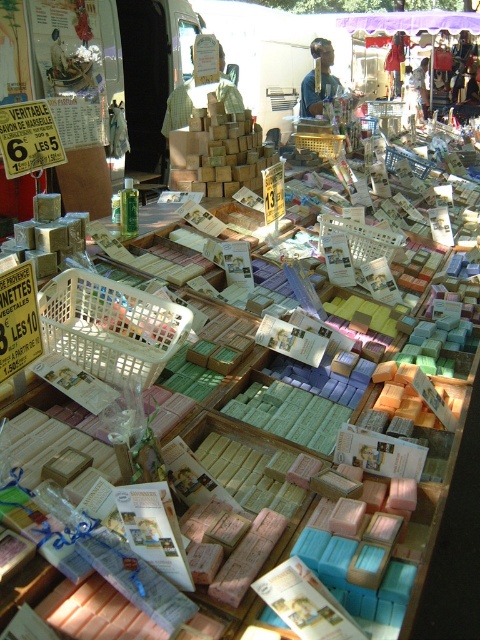
You are a customer at the market stall and want to pick up the matte brown wooden stick at upper center. However, there is a matte white shirt at upper center in the way. Can you reach the stick without moving the shirt?

The matte brown wooden stick at upper center is closer to the viewer than the matte white shirt at upper center, so you can reach the stick without moving the shirt.

You are a customer at the market stall and want to pick up both items located at point (322, 74) and point (421, 86). Which item should you pick up first to reach them in the shortest path?

You should pick up the item at point (322, 74) first since it is closer to you than the item at point (421, 86).